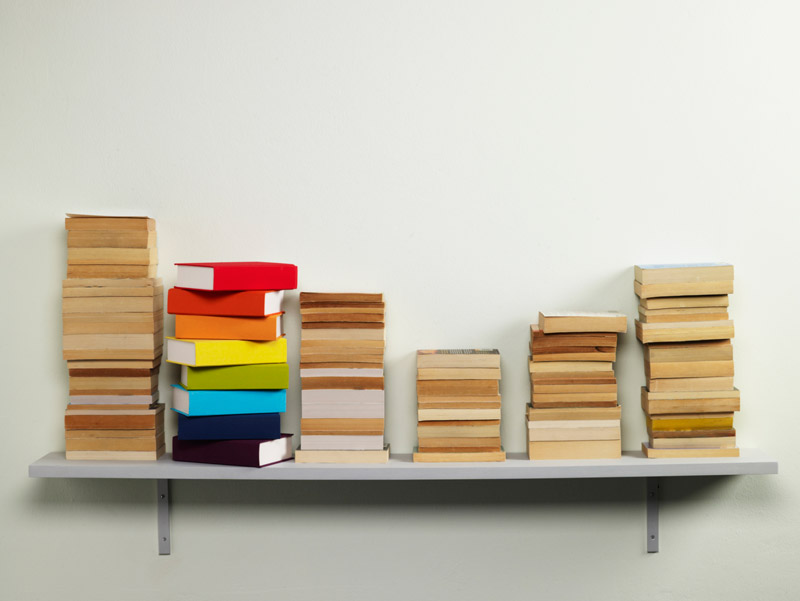
I want to click on stacks of books, so click(110, 377), click(238, 373), click(333, 385), click(446, 403), click(578, 409), click(674, 397).